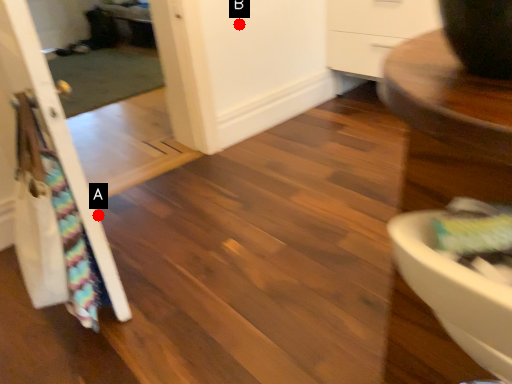
Question: Two points are circled on the image, labeled by A and B beside each circle. Which point is closer to the camera?

Choices:
 (A) A is closer
 (B) B is closer

Answer: (A)